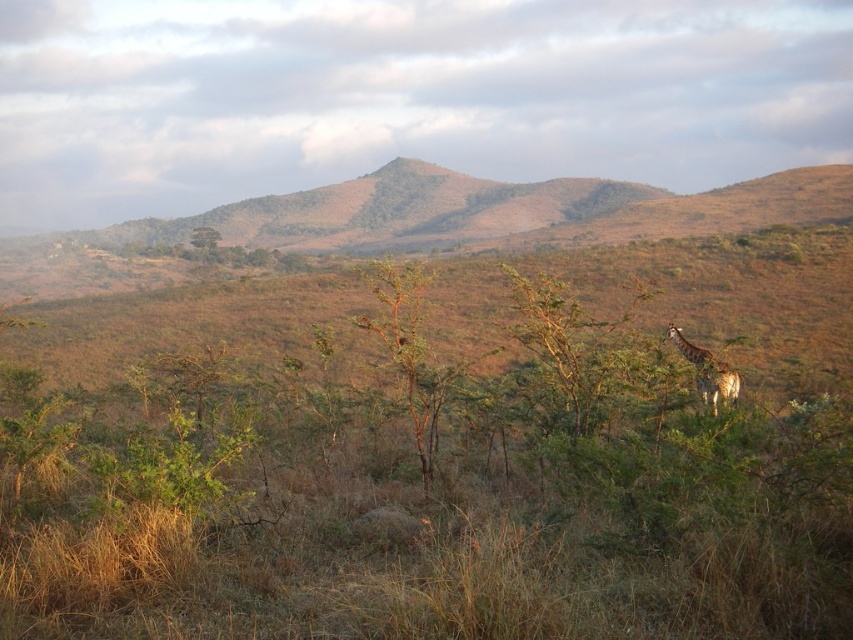
Between spotted fur giraffe at right and green leafy tree at upper center, which one appears on the right side from the viewer's perspective?

spotted fur giraffe at right

Is spotted fur giraffe at right taller than green leafy tree at upper center?

In fact, spotted fur giraffe at right may be shorter than green leafy tree at upper center.

Locate an element on the screen. spotted fur giraffe at right is located at coordinates (706, 371).